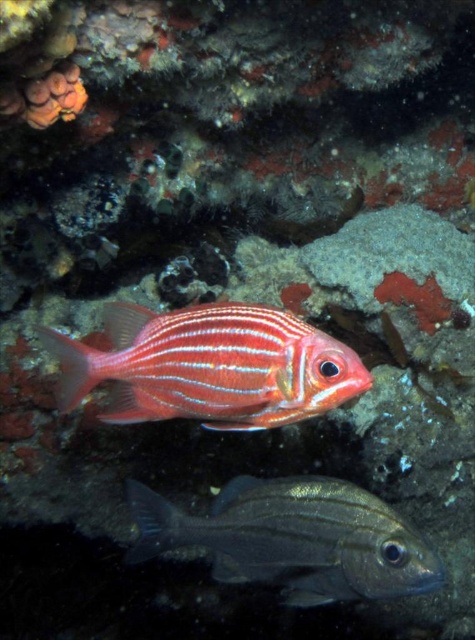
Does shiny red fish at center have a lesser height compared to shiny silver fish at center?

Yes.

Image resolution: width=475 pixels, height=640 pixels. In order to click on shiny red fish at center in this screenshot , I will do `click(209, 365)`.